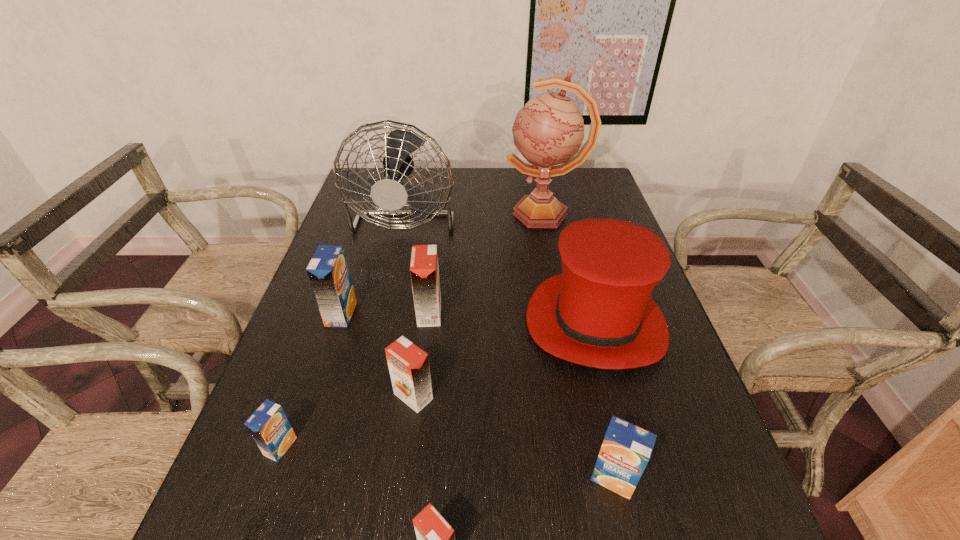
This screenshot has height=540, width=960. Find the location of `vacant space located on the back of the second biggest blue orange_juice`. vacant space located on the back of the second biggest blue orange_juice is located at coordinates (600, 420).

Where is `free region located on the back of the smallest blue orange_juice`? Image resolution: width=960 pixels, height=540 pixels. free region located on the back of the smallest blue orange_juice is located at coordinates (306, 376).

This screenshot has height=540, width=960. I want to click on globe that is at the far edge, so click(549, 129).

What are the coordinates of `fan present at the far edge` in the screenshot? It's located at (390, 194).

The height and width of the screenshot is (540, 960). Find the location of `fan that is at the left edge`. fan that is at the left edge is located at coordinates (390, 194).

Locate an element on the screen. This screenshot has width=960, height=540. globe that is at the right edge is located at coordinates (549, 129).

This screenshot has width=960, height=540. Identify the location of hat that is at the right edge. (599, 312).

I want to click on object located at the far left corner, so click(390, 194).

You are a GUI agent. You are given a task and a screenshot of the screen. Output one action in this format:
    pyautogui.click(x=<x>, y=<y>)
    Task: Click on the object located at the far right corner
    The width and height of the screenshot is (960, 540).
    Given the screenshot: What is the action you would take?
    pyautogui.click(x=549, y=129)

You are a GUI agent. You are given a task and a screenshot of the screen. Output one action in this format:
    pyautogui.click(x=<x>, y=<y>)
    Task: Click on the vacant region at the left edge of the desktop
    The width and height of the screenshot is (960, 540).
    Given the screenshot: What is the action you would take?
    pyautogui.click(x=302, y=382)